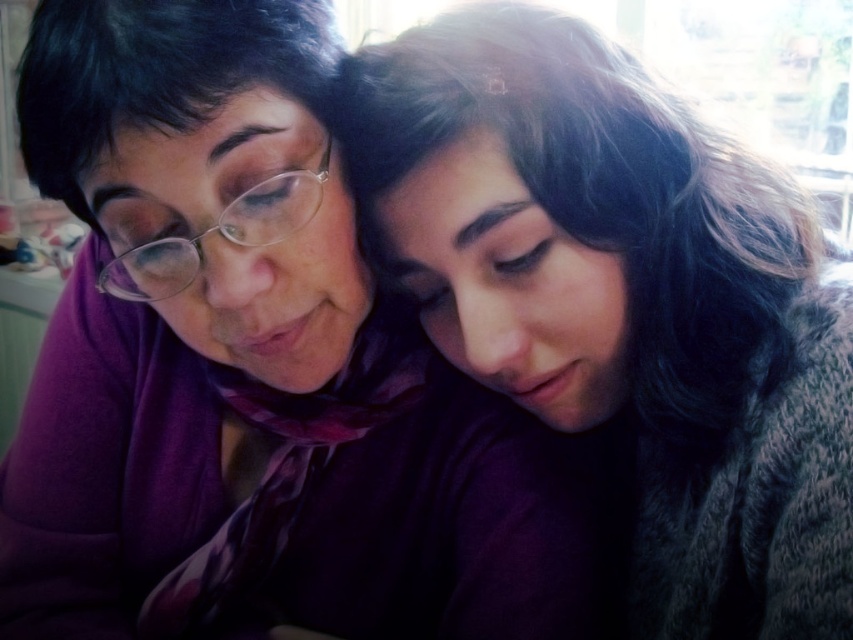
Question: Which is farther from the dark purple scarf at center?

Choices:
 (A) matte purple scarf at upper center
 (B) clear plastic glasses at upper left

Answer: (B)

Question: Can you confirm if matte purple scarf at upper center is thinner than clear plastic glasses at upper left?

Choices:
 (A) yes
 (B) no

Answer: (B)

Question: Which is nearer to the matte purple scarf at upper center?

Choices:
 (A) clear plastic glasses at upper left
 (B) dark purple scarf at center

Answer: (B)

Question: Does matte purple scarf at upper center appear under clear plastic glasses at upper left?

Choices:
 (A) yes
 (B) no

Answer: (A)

Question: Does matte purple scarf at upper center appear over dark purple scarf at center?

Choices:
 (A) no
 (B) yes

Answer: (A)

Question: Which is nearer to the clear plastic glasses at upper left?

Choices:
 (A) matte purple scarf at upper center
 (B) dark purple scarf at center

Answer: (A)